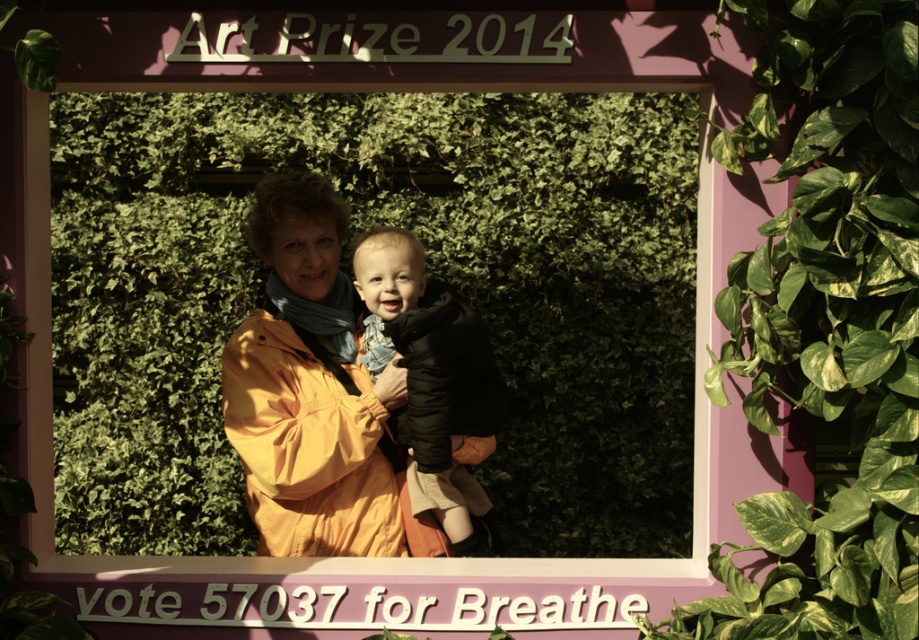
Based on the scene description, where is the green leafy plant at right located in terms of coordinates?

The green leafy plant at right is located at coordinates (827,324).

You are an artist trying to recreate the scene from the framed photograph. You need to decide the placement of the green leafy plant at center and the matte yellow jacket at center. Based on the description, which object should be positioned wider in your recreation?

The green leafy plant at center might be wider than the matte yellow jacket at center, so in your recreation, the green leafy plant at center should be placed wider than the matte yellow jacket at center to match the original scene.